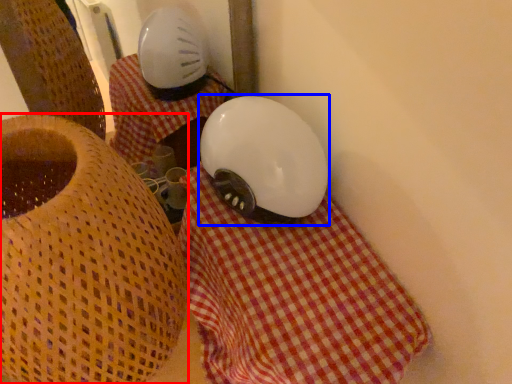
Question: Which of the following is the farthest to the observer, furniture (highlighted by a red box) or helmet (highlighted by a blue box)?

Choices:
 (A) furniture
 (B) helmet

Answer: (B)